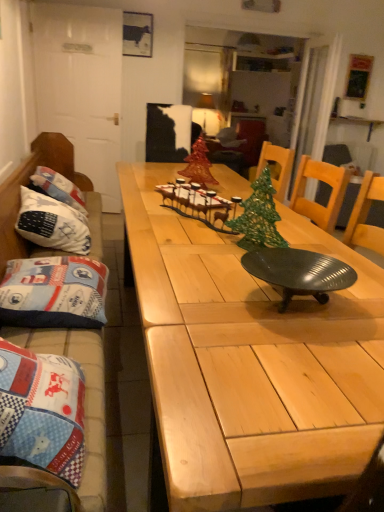
Describe the element at coordinates (298, 272) in the screenshot. I see `metallic dark green tray at center` at that location.

In order to face green metallic christmas tree at center, acting as the 2th christmas tree starting from the top, should I rotate leftwards or rightwards?

You should look right and rotate roughly 8.993 degrees.

The height and width of the screenshot is (512, 384). Describe the element at coordinates (85, 400) in the screenshot. I see `blue quilted cushion at left` at that location.

This screenshot has width=384, height=512. What do you see at coordinates (251, 361) in the screenshot?
I see `natural wood table at center` at bounding box center [251, 361].

What is the approximate width of shiny red glass christmas tree at center, the first christmas tree in the back-to-front sequence?

shiny red glass christmas tree at center, the first christmas tree in the back-to-front sequence, is 3.88 inches in width.

Where is `shiny red glass christmas tree at center, the first christmas tree in the back-to-front sequence`? shiny red glass christmas tree at center, the first christmas tree in the back-to-front sequence is located at coordinates (198, 165).

Identify the location of metallic dark green tray at center. (298, 272).

Is blue fabric pillow at left, which appears as the second pillow when viewed from the back, aimed at white fabric pillow at left, which is counted as the first pillow, starting from the back?

No.

From a real-world perspective, between blue fabric pillow at left, which appears as the second pillow when viewed from the back, and white fabric pillow at left, positioned as the 2th pillow in front-to-back order, who is vertically higher?

In real-world perspective, white fabric pillow at left, positioned as the 2th pillow in front-to-back order, is above.

Which is behind, point (10, 282) or point (58, 215)?

The point (58, 215) is behind.

In the scene shown: Is blue fabric pillow at left, arranged as the first pillow when viewed from the front, bigger or smaller than white fabric pillow at left, which is counted as the first pillow, starting from the back?

blue fabric pillow at left, arranged as the first pillow when viewed from the front, is smaller than white fabric pillow at left, which is counted as the first pillow, starting from the back.

Can you confirm if white fabric pillow at left, positioned as the 2th pillow in front-to-back order, is shorter than shiny red glass christmas tree at center, the 1th christmas tree from the left?

No, white fabric pillow at left, positioned as the 2th pillow in front-to-back order, is not shorter than shiny red glass christmas tree at center, the 1th christmas tree from the left.

Can you confirm if white fabric pillow at left, positioned as the 2th pillow in front-to-back order, is positioned to the right of shiny red glass christmas tree at center, the second christmas tree from the front?

No.

What's the angular difference between white fabric pillow at left, which is counted as the first pillow, starting from the back, and shiny red glass christmas tree at center, the 1th christmas tree from the left,'s facing directions?

30.5 degrees.

Can you confirm if white fabric pillow at left, which is counted as the first pillow, starting from the back, is thinner than shiny red glass christmas tree at center, which is the second christmas tree in right-to-left order?

No, white fabric pillow at left, which is counted as the first pillow, starting from the back, is not thinner than shiny red glass christmas tree at center, which is the second christmas tree in right-to-left order.

Consider the image. Can you confirm if blue fabric pillow at left, arranged as the first pillow when viewed from the front, is shorter than green metallic christmas tree at center, acting as the 2th christmas tree starting from the top?

Yes.

Between blue fabric pillow at left, arranged as the first pillow when viewed from the front, and green metallic christmas tree at center, the 2th christmas tree from the left, which one has larger width?

blue fabric pillow at left, arranged as the first pillow when viewed from the front, is wider.

Is green metallic christmas tree at center, acting as the 2th christmas tree starting from the top, at the back of blue fabric pillow at left, which appears as the second pillow when viewed from the back?

blue fabric pillow at left, which appears as the second pillow when viewed from the back, does not have its back to green metallic christmas tree at center, acting as the 2th christmas tree starting from the top.

Considering the positions of objects blue fabric pillow at left, arranged as the first pillow when viewed from the front, and green metallic christmas tree at center, the 2th christmas tree from the left, in the image provided, who is in front, blue fabric pillow at left, arranged as the first pillow when viewed from the front, or green metallic christmas tree at center, the 2th christmas tree from the left,?

green metallic christmas tree at center, the 2th christmas tree from the left, is more forward.

In terms of size, does blue quilted cushion at left appear bigger or smaller than shiny red glass christmas tree at center, which is the second christmas tree in right-to-left order?

Clearly, blue quilted cushion at left is larger in size than shiny red glass christmas tree at center, which is the second christmas tree in right-to-left order.

Is blue quilted cushion at left situated inside shiny red glass christmas tree at center, the second christmas tree from the front, or outside?

blue quilted cushion at left is not inside shiny red glass christmas tree at center, the second christmas tree from the front, it's outside.

Is blue quilted cushion at left in front of or behind shiny red glass christmas tree at center, the second christmas tree from the front, in the image?

blue quilted cushion at left is in front of shiny red glass christmas tree at center, the second christmas tree from the front.

Can you confirm if blue quilted cushion at left is positioned to the right of shiny red glass christmas tree at center, the second christmas tree from the front?

No, blue quilted cushion at left is not to the right of shiny red glass christmas tree at center, the second christmas tree from the front.

Is natural wood table at center positioned far away from blue fabric pillow at left, which appears as the second pillow when viewed from the back?

They are positioned close to each other.

Considering the relative positions of natural wood table at center and blue fabric pillow at left, which appears as the second pillow when viewed from the back, in the image provided, is natural wood table at center to the left of blue fabric pillow at left, which appears as the second pillow when viewed from the back, from the viewer's perspective?

In fact, natural wood table at center is to the right of blue fabric pillow at left, which appears as the second pillow when viewed from the back.

From the image's perspective, is natural wood table at center under blue fabric pillow at left, arranged as the first pillow when viewed from the front?

Yes, from the image's perspective, natural wood table at center is beneath blue fabric pillow at left, arranged as the first pillow when viewed from the front.

Can you tell me how much natural wood table at center and blue fabric pillow at left, arranged as the first pillow when viewed from the front, differ in facing direction?

They differ by 0.804 degrees in their facing directions.

Would you say natural wood table at center is a long distance from green metallic christmas tree at center, placed as the first christmas tree when sorted from bottom to top?

No.

Which object is further away from the camera taking this photo, natural wood table at center or green metallic christmas tree at center, the 2th christmas tree from the left?

green metallic christmas tree at center, the 2th christmas tree from the left, is further away from the camera.

Where is `the 1st christmas tree behind the natural wood table at center`? The width and height of the screenshot is (384, 512). the 1st christmas tree behind the natural wood table at center is located at coordinates (259, 217).

Between natural wood table at center and green metallic christmas tree at center, the 2th christmas tree when ordered from back to front, which one appears on the right side from the viewer's perspective?

green metallic christmas tree at center, the 2th christmas tree when ordered from back to front.

Which object is positioned more to the left, metallic dark green tray at center or blue quilted cushion at left?

Positioned to the left is blue quilted cushion at left.

Can blue quilted cushion at left be found inside metallic dark green tray at center?

No, blue quilted cushion at left is not inside metallic dark green tray at center.

Based on the photo, is metallic dark green tray at center directly adjacent to blue quilted cushion at left?

No, metallic dark green tray at center is not in contact with blue quilted cushion at left.

Image resolution: width=384 pixels, height=512 pixels. I want to click on studio couch above the metallic dark green tray at center (from the image's perspective), so click(85, 400).

The height and width of the screenshot is (512, 384). I want to click on pillow below the white fabric pillow at left, positioned as the 2th pillow in front-to-back order (from the image's perspective), so click(x=54, y=293).

This screenshot has width=384, height=512. What are the coordinates of `christmas tree above the white fabric pillow at left, positioned as the 2th pillow in front-to-back order (from the image's perspective)` in the screenshot? It's located at pos(198,165).

Estimate the real-world distances between objects in this image. Which object is further from white fabric pillow at left, which is counted as the first pillow, starting from the back, natural wood table at center or blue fabric pillow at left, arranged as the first pillow when viewed from the front?

The object further to white fabric pillow at left, which is counted as the first pillow, starting from the back, is natural wood table at center.

Considering their positions, is metallic dark green tray at center positioned closer to natural wood table at center than blue fabric pillow at left, which appears as the second pillow when viewed from the back?

metallic dark green tray at center is closer to natural wood table at center.

Based on the photo, looking at the image, which one is located further to natural wood table at center, shiny red glass christmas tree at center, the second christmas tree from the front, or blue fabric pillow at left, arranged as the first pillow when viewed from the front?

shiny red glass christmas tree at center, the second christmas tree from the front.

From the image, which object appears to be farther from blue quilted cushion at left, metallic dark green tray at center or green metallic christmas tree at center, the 2th christmas tree when ordered from back to front?

Based on the image, metallic dark green tray at center appears to be further to blue quilted cushion at left.

Which object lies nearer to the anchor point natural wood table at center, green metallic christmas tree at center, the 2th christmas tree when ordered from back to front, or white fabric pillow at left, which is counted as the first pillow, starting from the back?

The object closer to natural wood table at center is green metallic christmas tree at center, the 2th christmas tree when ordered from back to front.

Considering their positions, is blue quilted cushion at left positioned closer to blue fabric pillow at left, arranged as the first pillow when viewed from the front, than natural wood table at center?

Among the two, blue quilted cushion at left is located nearer to blue fabric pillow at left, arranged as the first pillow when viewed from the front.

Looking at the image, which one is located closer to natural wood table at center, metallic dark green tray at center or green metallic christmas tree at center, the 2th christmas tree when ordered from back to front?

The object closer to natural wood table at center is metallic dark green tray at center.

Estimate the real-world distances between objects in this image. Which object is closer to shiny red glass christmas tree at center, which is the second christmas tree in right-to-left order, blue quilted cushion at left or natural wood table at center?

blue quilted cushion at left lies closer to shiny red glass christmas tree at center, which is the second christmas tree in right-to-left order, than the other object.

Identify the location of table between blue quilted cushion at left and shiny red glass christmas tree at center, the 1th christmas tree from the left, along the z-axis. The width and height of the screenshot is (384, 512). (251, 361).

Where is `christmas tree between natural wood table at center and white fabric pillow at left, which is counted as the first pillow, starting from the back, from front to back`? The width and height of the screenshot is (384, 512). christmas tree between natural wood table at center and white fabric pillow at left, which is counted as the first pillow, starting from the back, from front to back is located at coordinates (259, 217).

At what (x,y) coordinates should I click in order to perform the action: click on pillow between blue quilted cushion at left and green metallic christmas tree at center, the first christmas tree from the right, in the horizontal direction. Please return your answer as a coordinate pair (x, y). Looking at the image, I should click on (54, 293).

You are a GUI agent. You are given a task and a screenshot of the screen. Output one action in this format:
    pyautogui.click(x=<x>, y=<y>)
    Task: Click on the pillow between white fabric pillow at left, positioned as the 2th pillow in front-to-back order, and metallic dark green tray at center from left to right
    This screenshot has width=384, height=512.
    Given the screenshot: What is the action you would take?
    pyautogui.click(x=54, y=293)